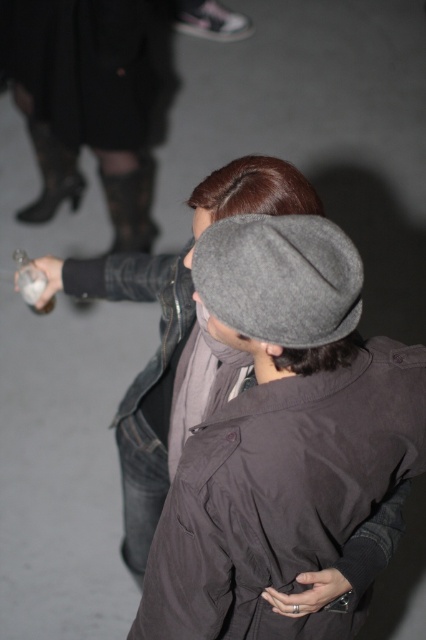
Consider the image. You are at a party and see two people talking. One has a matte gray cap at center and the other has a gray woolen cap at center. Which cap is closer to you?

The matte gray cap at center is closer to you because it is in front of the gray woolen cap at center.

In the scene shown: You are at a party and want to grab the translucent glass bottle at lower left without touching the matte gray cap at center. Is it possible to reach it without moving the cap?

The matte gray cap at center is in front of the translucent glass bottle at lower left, so you can reach around or behind the cap to grab the bottle without touching it.

You are at a party and need to decide which item is larger between the gray woolen cap at center and the translucent glass bottle at lower left. Based on the scene, which one is bigger?

The gray woolen cap at center is bigger than the translucent glass bottle at lower left according to the description.